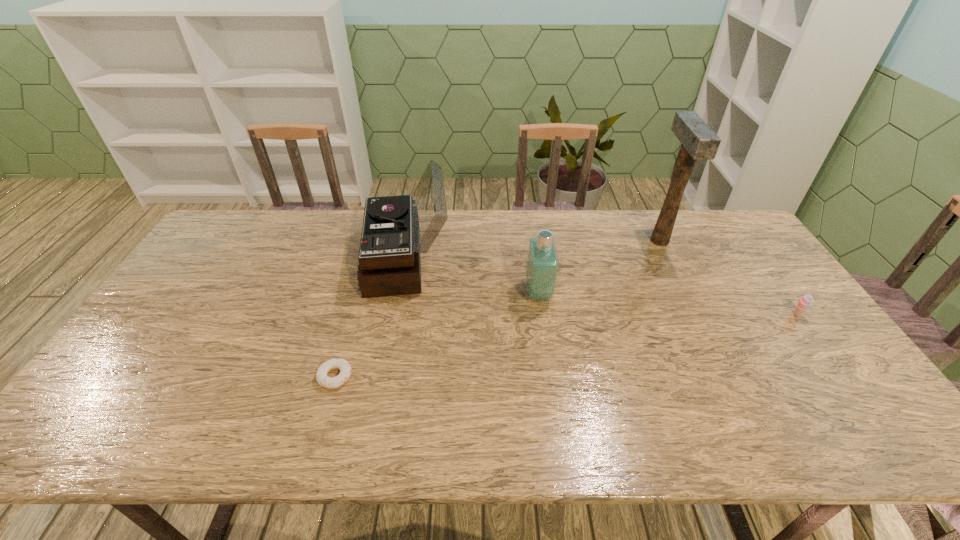
The image size is (960, 540). Find the location of `the fourth object from left to right`. the fourth object from left to right is located at coordinates (699, 142).

The image size is (960, 540). In order to click on mallet in this screenshot , I will do `click(699, 142)`.

Where is `record player`? The height and width of the screenshot is (540, 960). record player is located at coordinates (396, 229).

Identify the location of the third object from right to left. (542, 265).

Where is `perfume`? This screenshot has width=960, height=540. perfume is located at coordinates (542, 265).

The width and height of the screenshot is (960, 540). I want to click on the rightmost object, so click(x=805, y=302).

At what (x,y) coordinates should I click in order to perform the action: click on the fourth farthest object. Please return your answer as a coordinate pair (x, y). The width and height of the screenshot is (960, 540). Looking at the image, I should click on 805,302.

This screenshot has height=540, width=960. Identify the location of doughnut. (344, 366).

Where is `the nearest object`? the nearest object is located at coordinates coord(344,366).

Image resolution: width=960 pixels, height=540 pixels. I want to click on vacant space situated on the left of the mallet, so pyautogui.click(x=581, y=240).